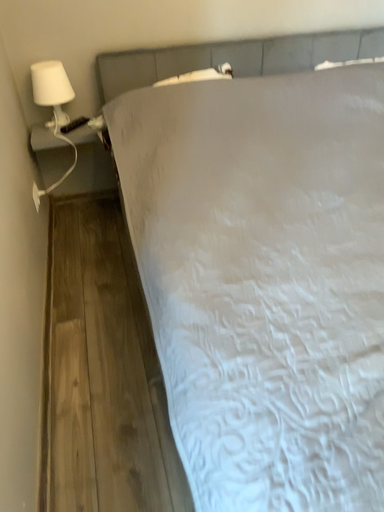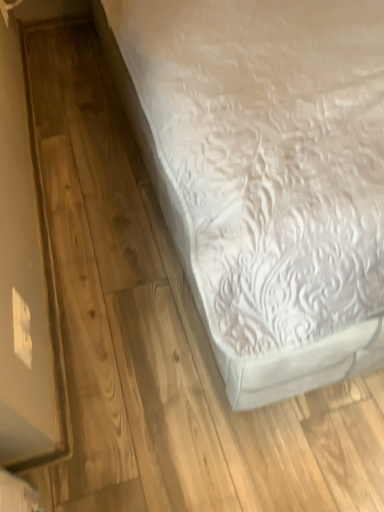
Question: How did the camera likely rotate when shooting the video?

Choices:
 (A) rotated downward
 (B) rotated upward

Answer: (A)